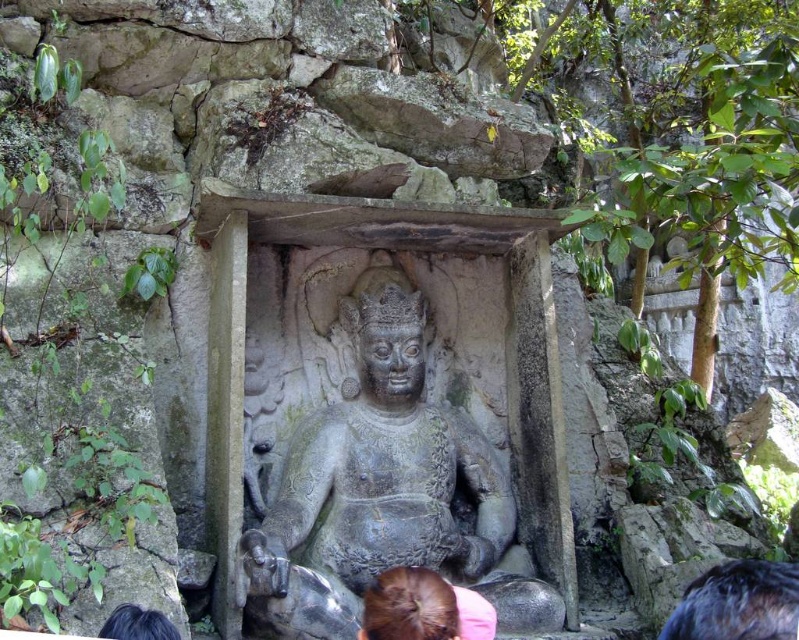
Looking at this image, can you confirm if dark brown hair at lower right is bigger than black hair at lower left?

Indeed, dark brown hair at lower right has a larger size compared to black hair at lower left.

Who is higher up, dark brown hair at lower right or black hair at lower left?

Positioned higher is black hair at lower left.

Where is `dark brown hair at lower right`? This screenshot has width=799, height=640. dark brown hair at lower right is located at coordinates (738, 602).

Can you confirm if brown hair at lower center is bigger than black hair at lower left?

Yes.

Does point (404, 588) come closer to viewer compared to point (157, 625)?

That is False.

Is point (416, 593) positioned after point (120, 609)?

That is True.

Find the location of a particular element. This screenshot has height=640, width=799. brown hair at lower center is located at coordinates (423, 609).

Which of these two, gray stone statue at center or brown hair at lower center, stands shorter?

Standing shorter between the two is brown hair at lower center.

At what (x,y) coordinates should I click in order to perform the action: click on gray stone statue at center. Please return your answer as a coordinate pair (x, y). The width and height of the screenshot is (799, 640). Looking at the image, I should click on (384, 486).

This screenshot has width=799, height=640. I want to click on gray stone statue at center, so click(384, 486).